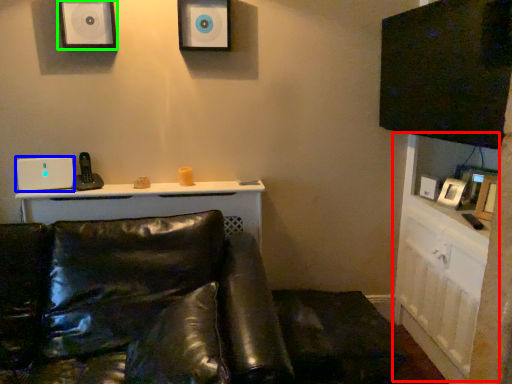
Question: Estimate the real-world distances between objects in this image. Which object is farther from dresser (highlighted by a red box), speaker (highlighted by a blue box) or speaker (highlighted by a green box)?

Choices:
 (A) speaker
 (B) speaker

Answer: (A)